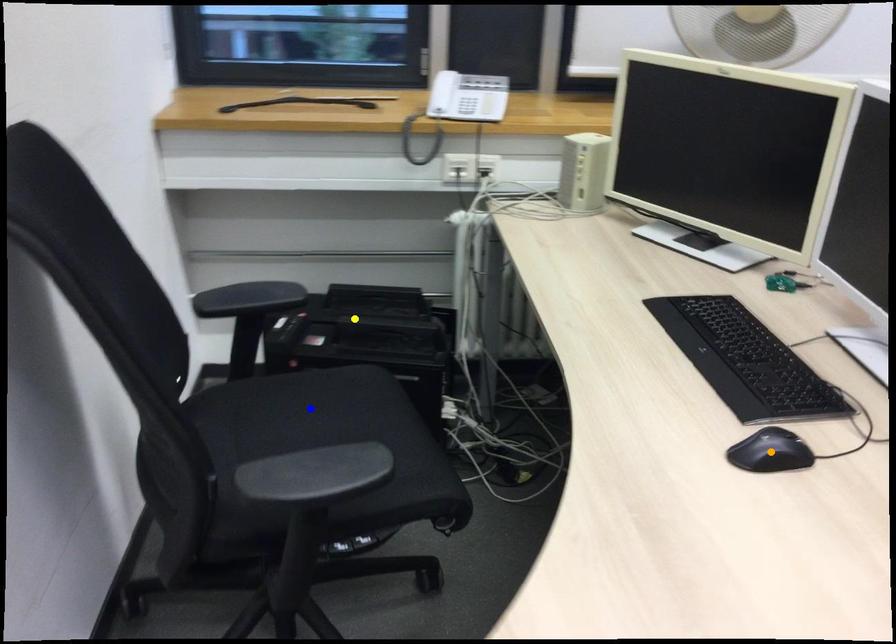
Order these from nearest to farthest:
1. yellow point
2. orange point
3. blue point

orange point, blue point, yellow point